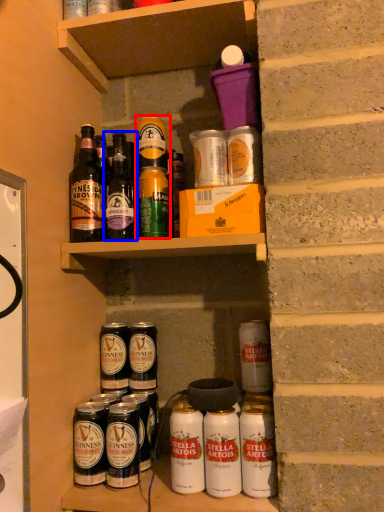
Question: Which object appears closest to the camera in this image, yoghurt (highlighted by a red box) or bottle (highlighted by a blue box)?

Choices:
 (A) yoghurt
 (B) bottle

Answer: (B)